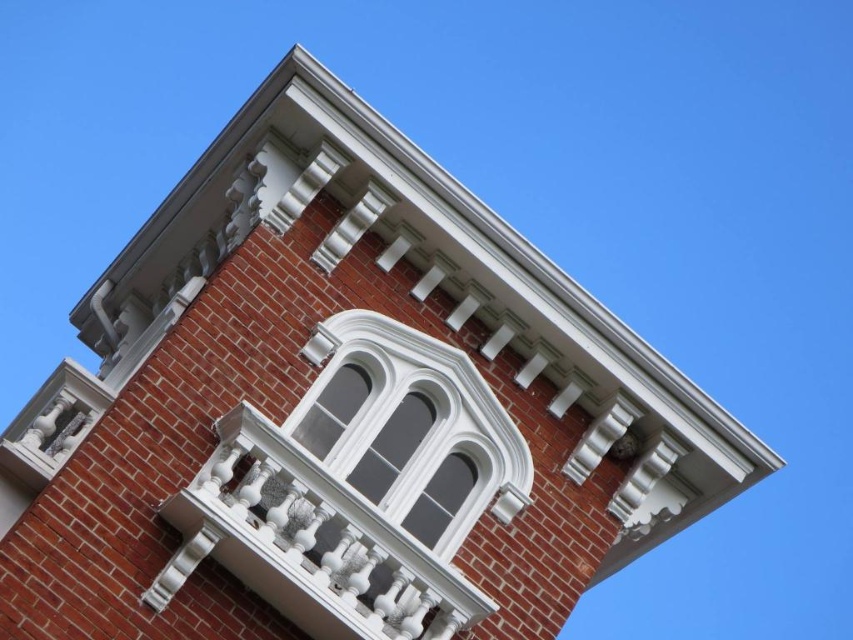
Question: Can you confirm if white glossy window at center is bigger than white glossy window at upper center?

Choices:
 (A) yes
 (B) no

Answer: (B)

Question: Does white textured balcony at upper center have a lesser width compared to white glossy window at center?

Choices:
 (A) no
 (B) yes

Answer: (B)

Question: Which point is farther to the camera?

Choices:
 (A) (357, 378)
 (B) (393, 397)
 (C) (299, 582)

Answer: (A)

Question: Does white textured balcony at upper center have a larger size compared to white glossy window at upper center?

Choices:
 (A) no
 (B) yes

Answer: (A)

Question: Which point appears closest to the camera in this image?

Choices:
 (A) (300, 440)
 (B) (512, 516)

Answer: (A)

Question: Which point appears farthest from the camera in this image?

Choices:
 (A) (503, 452)
 (B) (341, 394)

Answer: (A)